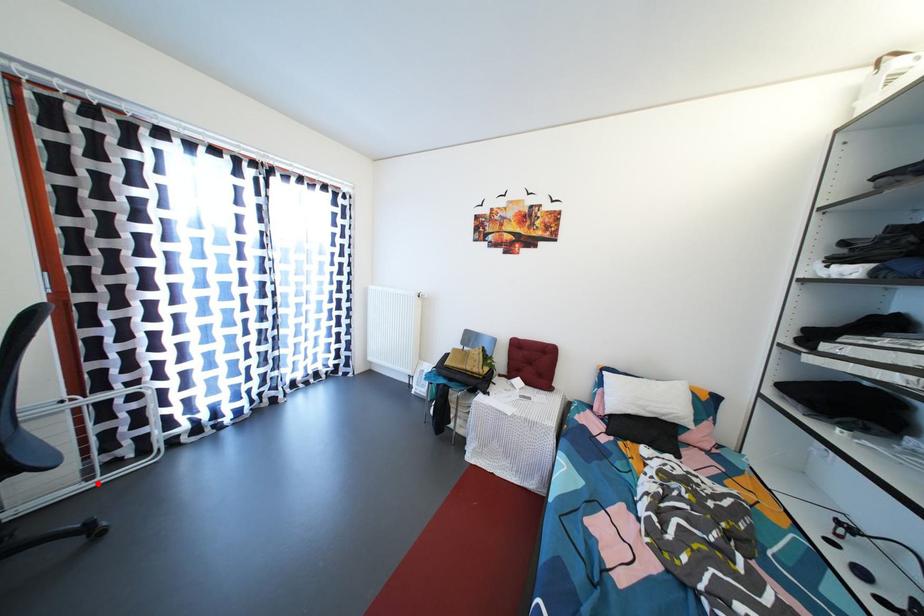
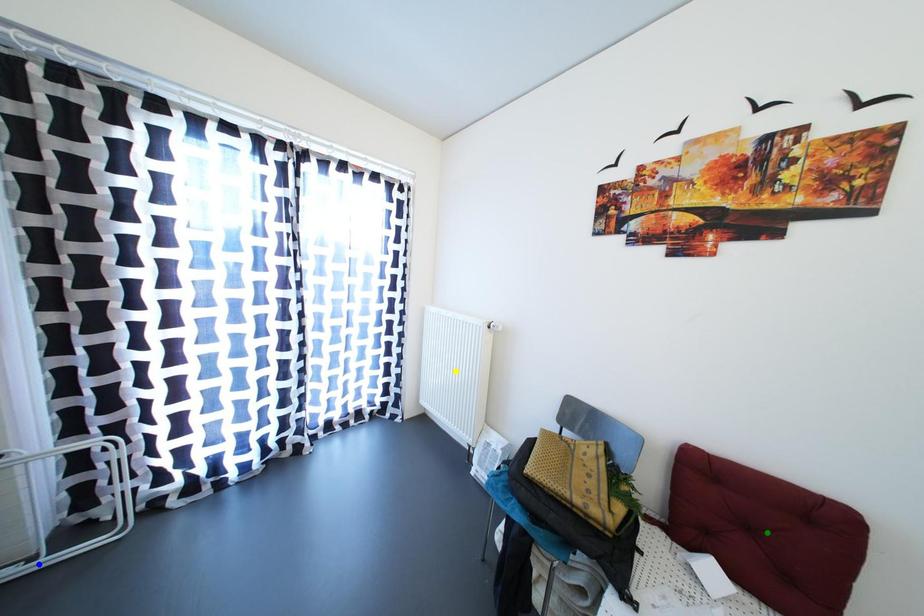
Question: I am providing you with two images of the same scene from different viewpoints. A red point is marked on the first image. You are given multiple points on the second image. In image 2, which mark is for the same physical point as the one in image 1?

Choices:
 (A) green point
 (B) blue point
 (C) yellow point

Answer: (B)